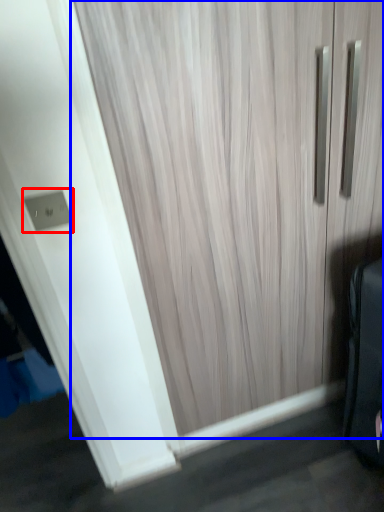
Question: Which of the following is the farthest to the observer, electric outlet (highlighted by a red box) or door (highlighted by a blue box)?

Choices:
 (A) electric outlet
 (B) door

Answer: (A)